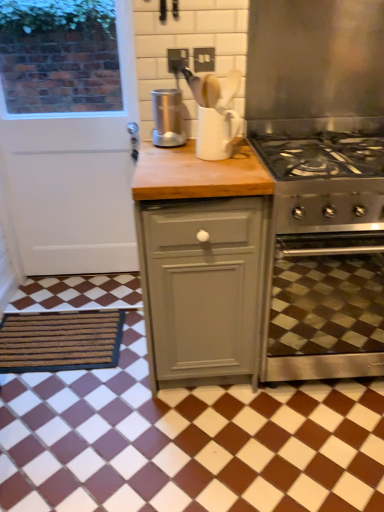
Locate an element on the screen. free location in front of white glossy mug at upper center is located at coordinates (218, 165).